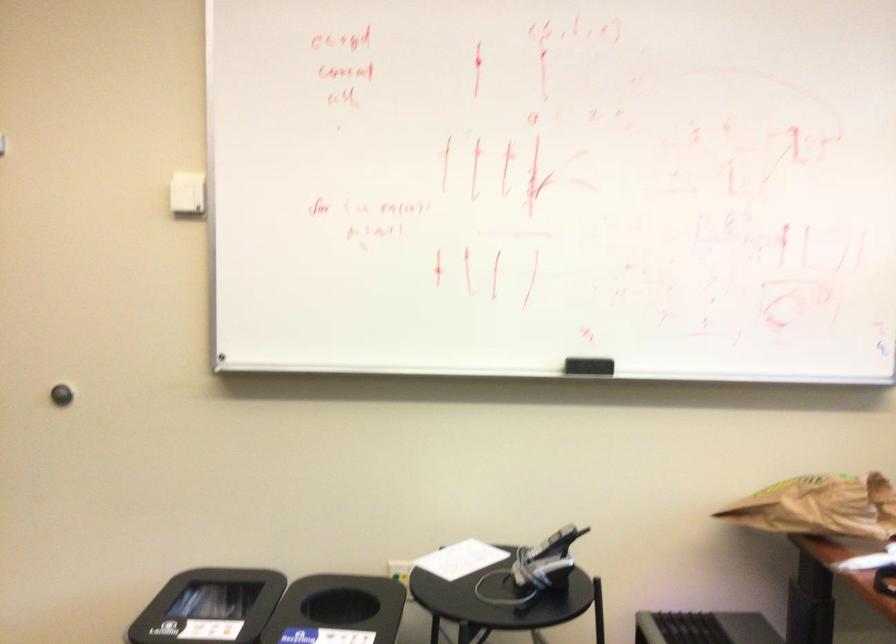
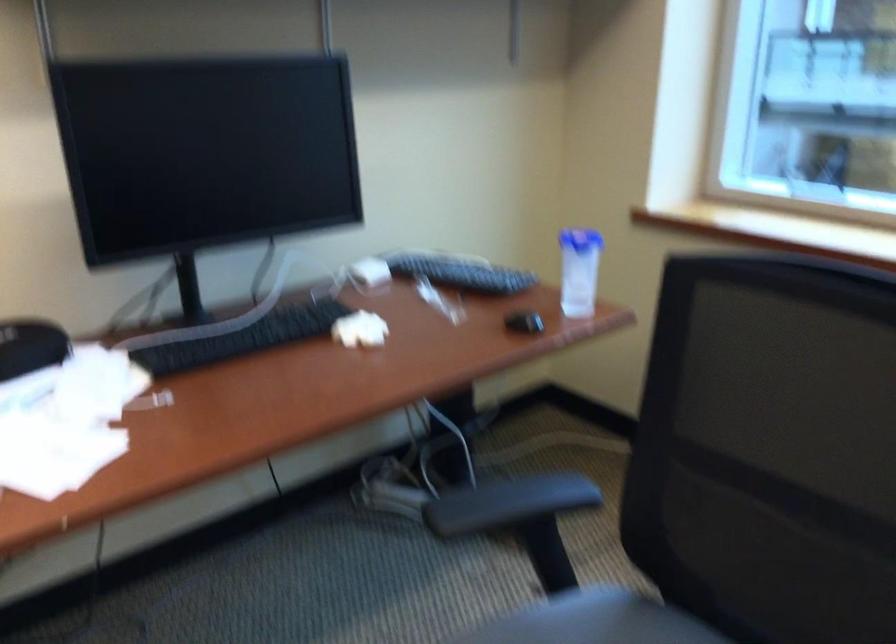
The images are taken continuously from a first-person perspective. In which direction is your viewpoint rotating?

The rotation direction of the camera is right-down.